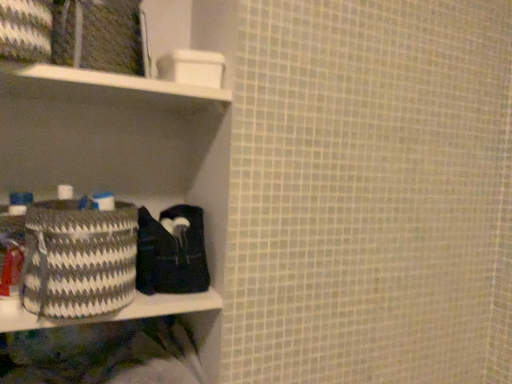
Question: Considering the relative sizes of textured woven basket at lower left and white and gray woven basket at left in the image provided, is textured woven basket at lower left shorter than white and gray woven basket at left?

Choices:
 (A) yes
 (B) no

Answer: (A)

Question: Considering the relative sizes of textured woven basket at lower left and white and gray woven basket at left in the image provided, is textured woven basket at lower left taller than white and gray woven basket at left?

Choices:
 (A) yes
 (B) no

Answer: (B)

Question: Is textured woven basket at lower left bigger than white and gray woven basket at left?

Choices:
 (A) yes
 (B) no

Answer: (B)

Question: From the image's perspective, is textured woven basket at lower left located beneath white and gray woven basket at left?

Choices:
 (A) no
 (B) yes

Answer: (B)

Question: Does textured woven basket at lower left have a greater width compared to white and gray woven basket at left?

Choices:
 (A) no
 (B) yes

Answer: (B)

Question: Looking at their shapes, would you say black fabric at lower left is wider or thinner than white and gray woven basket at left?

Choices:
 (A) thin
 (B) wide

Answer: (B)

Question: Is black fabric at lower left inside or outside of white and gray woven basket at left?

Choices:
 (A) inside
 (B) outside

Answer: (B)

Question: From a real-world perspective, relative to white and gray woven basket at left, is black fabric at lower left vertically above or below?

Choices:
 (A) below
 (B) above

Answer: (A)

Question: In the image, is black fabric at lower left positioned in front of or behind white and gray woven basket at left?

Choices:
 (A) behind
 (B) front

Answer: (A)

Question: Relative to textured woven basket at lower left, is white plastic shelf at upper left in front or behind?

Choices:
 (A) behind
 (B) front

Answer: (B)

Question: From a real-world perspective, is white plastic shelf at upper left positioned above or below textured woven basket at lower left?

Choices:
 (A) above
 (B) below

Answer: (A)

Question: Choose the correct answer: Is white plastic shelf at upper left inside textured woven basket at lower left or outside it?

Choices:
 (A) inside
 (B) outside

Answer: (B)

Question: Is white plastic shelf at upper left to the left or to the right of textured woven basket at lower left in the image?

Choices:
 (A) right
 (B) left

Answer: (A)

Question: In the image, is black fabric at lower left on the left side or the right side of textured woven basket at lower left?

Choices:
 (A) left
 (B) right

Answer: (B)

Question: Looking at their shapes, would you say black fabric at lower left is wider or thinner than textured woven basket at lower left?

Choices:
 (A) wide
 (B) thin

Answer: (B)